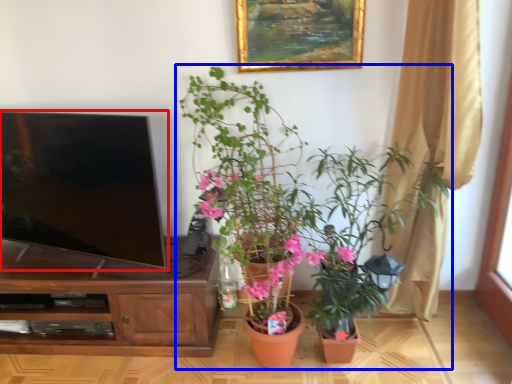
Question: Which of the following is the closest to the observer, television (highlighted by a red box) or houseplant (highlighted by a blue box)?

Choices:
 (A) television
 (B) houseplant

Answer: (B)